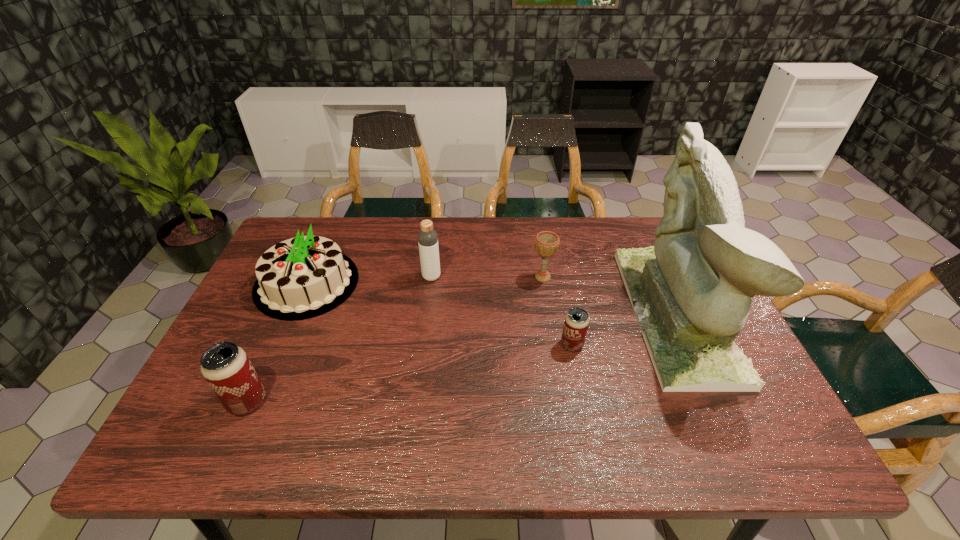
The height and width of the screenshot is (540, 960). Identify the location of spot to insert another beer_can for uniform distribution. (419, 372).